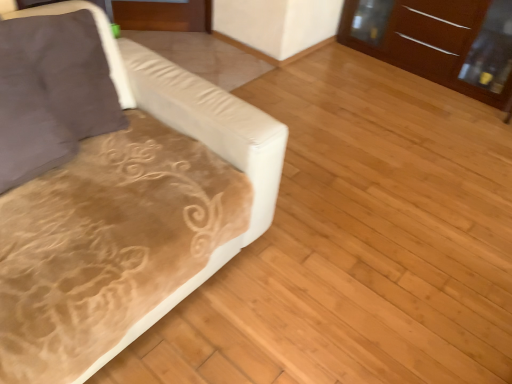
Locate an element on the screen. empty space that is to the right of velvet beige couch at left is located at coordinates (335, 294).